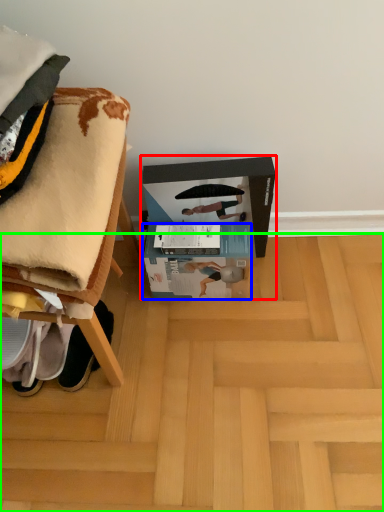
Question: Which object is the farthest from cardboard box (highlighted by a red box)? Choose among these: box (highlighted by a blue box) or wood (highlighted by a green box).

Choices:
 (A) box
 (B) wood

Answer: (B)